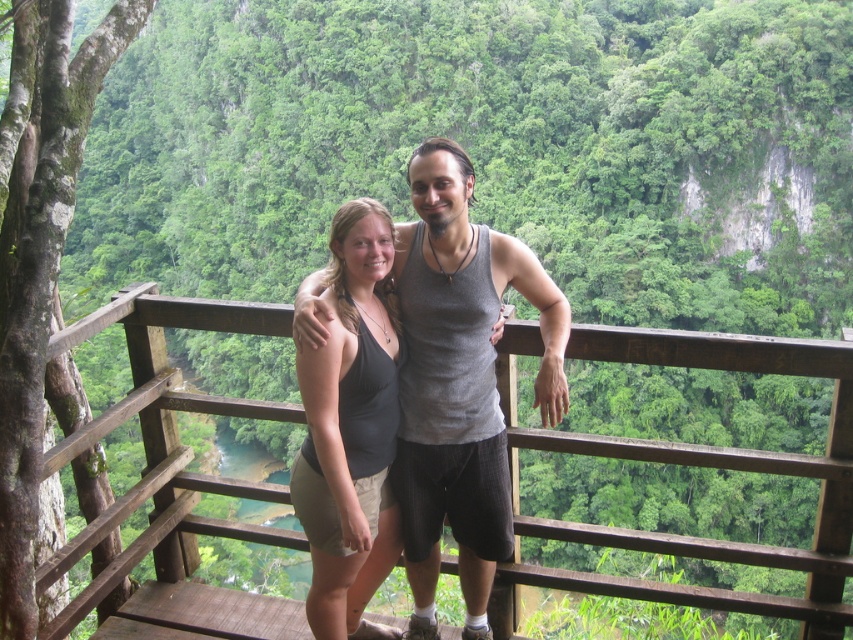
Question: Which object appears farthest from the camera in this image?

Choices:
 (A) gray tank top at center
 (B) black fabric tank top at center
 (C) wooden at center

Answer: (B)

Question: Which is nearer to the black fabric tank top at center?

Choices:
 (A) wooden at center
 (B) gray tank top at center

Answer: (B)

Question: Among these points, which one is farthest from the camera?

Choices:
 (A) (808, 456)
 (B) (410, 412)
 (C) (392, 538)

Answer: (A)

Question: Considering the relative positions of gray tank top at center and black fabric tank top at center in the image provided, where is gray tank top at center located with respect to black fabric tank top at center?

Choices:
 (A) above
 (B) below

Answer: (A)

Question: Does wooden at center appear over gray tank top at center?

Choices:
 (A) no
 (B) yes

Answer: (A)

Question: Is wooden at center below gray tank top at center?

Choices:
 (A) no
 (B) yes

Answer: (B)